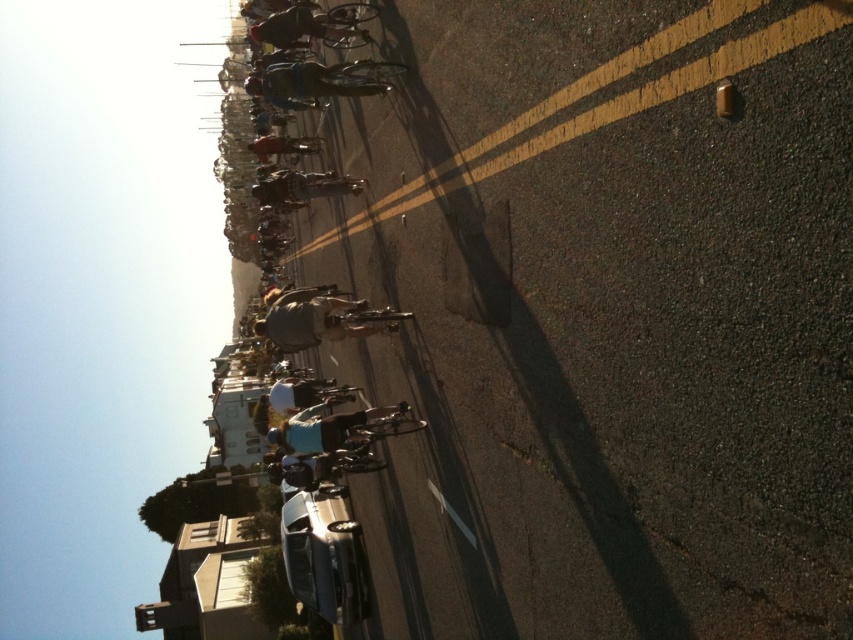
Does point (546, 145) lie in front of point (317, 589)?

That is True.

How distant is yellow asphalt road at center from metallic silver car at center?

A distance of 43.56 feet exists between yellow asphalt road at center and metallic silver car at center.

What are the coordinates of `yellow asphalt road at center` in the screenshot? It's located at (601, 104).